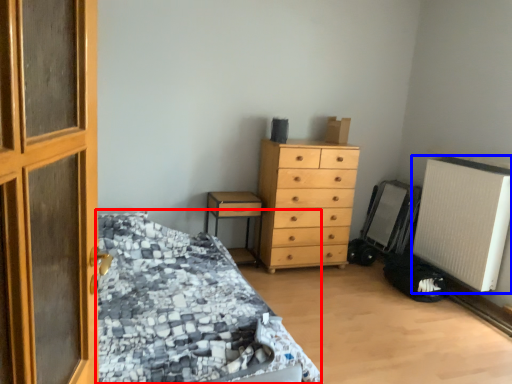
Question: Which object appears farthest to the camera in this image, bed (highlighted by a red box) or air conditioning (highlighted by a blue box)?

Choices:
 (A) bed
 (B) air conditioning

Answer: (B)